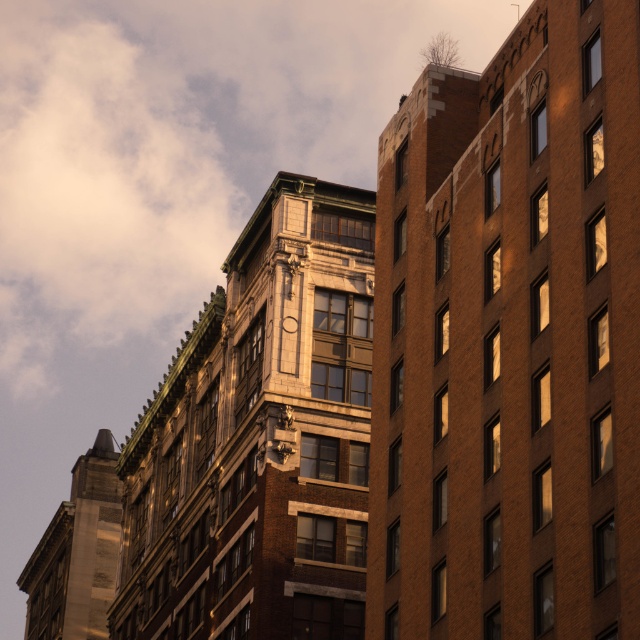
You are standing in front of the two buildings shown in the image. You notice two points marked in the scene. The first point is at coordinate point (x=496, y=166), and the second is at point (x=294, y=324). Which of these points is nearer to your current position?

Point (x=496, y=166) is closer to the camera than point (x=294, y=324), so the first point is nearer to your current position.

You are an architect evaluating the urban skyline. You need to determine which structure, the brown brick building at right or the wooden clock at upper center, has a greater height. Based on the scene provided, which one is taller?

The brown brick building at right is taller than the wooden clock at upper center.